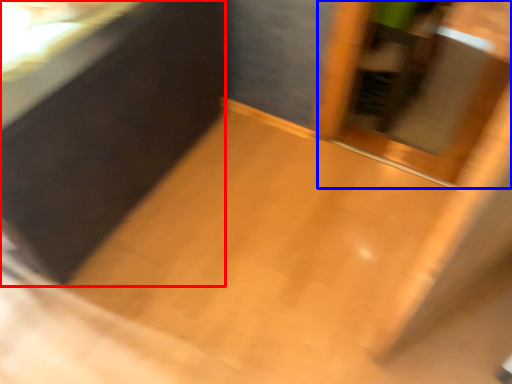
Question: Which object is closer to the camera taking this photo, vanity (highlighted by a red box) or screen door (highlighted by a blue box)?

Choices:
 (A) vanity
 (B) screen door

Answer: (A)